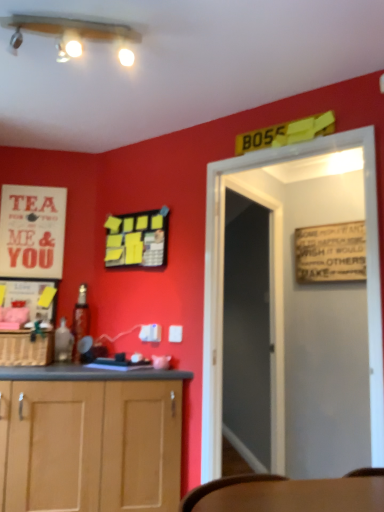
Question: Is woven brown basket at lower left positioned with its back to white paper poster at upper left?

Choices:
 (A) no
 (B) yes

Answer: (A)

Question: Can you confirm if woven brown basket at lower left is thinner than white paper poster at upper left?

Choices:
 (A) yes
 (B) no

Answer: (B)

Question: Can you confirm if woven brown basket at lower left is positioned to the right of white paper poster at upper left?

Choices:
 (A) no
 (B) yes

Answer: (B)

Question: Is woven brown basket at lower left behind white paper poster at upper left?

Choices:
 (A) yes
 (B) no

Answer: (B)

Question: Are woven brown basket at lower left and white paper poster at upper left located far from each other?

Choices:
 (A) no
 (B) yes

Answer: (A)

Question: Is white paper poster at upper left inside the boundaries of transparent glass door at center, or outside?

Choices:
 (A) outside
 (B) inside

Answer: (A)

Question: From a real-world perspective, is white paper poster at upper left positioned above or below transparent glass door at center?

Choices:
 (A) below
 (B) above

Answer: (B)

Question: Is point (13, 266) positioned closer to the camera than point (233, 210)?

Choices:
 (A) farther
 (B) closer

Answer: (B)

Question: From the image's perspective, is white paper poster at upper left located above or below transparent glass door at center?

Choices:
 (A) below
 (B) above

Answer: (B)

Question: From a real-world perspective, is white wooden door at center positioned above or below matte white lights at upper center?

Choices:
 (A) above
 (B) below

Answer: (B)

Question: Choose the correct answer: Is white wooden door at center inside matte white lights at upper center or outside it?

Choices:
 (A) inside
 (B) outside

Answer: (B)

Question: In the image, is white wooden door at center positioned in front of or behind matte white lights at upper center?

Choices:
 (A) front
 (B) behind

Answer: (B)

Question: In terms of width, does white wooden door at center look wider or thinner when compared to matte white lights at upper center?

Choices:
 (A) wide
 (B) thin

Answer: (B)

Question: Is metallic glass bottle at left, acting as the 2th bottle starting from the front, situated inside white paper poster at upper left or outside?

Choices:
 (A) outside
 (B) inside

Answer: (A)

Question: Is metallic glass bottle at left, which is the first bottle from back to front, in front of or behind white paper poster at upper left in the image?

Choices:
 (A) front
 (B) behind

Answer: (A)